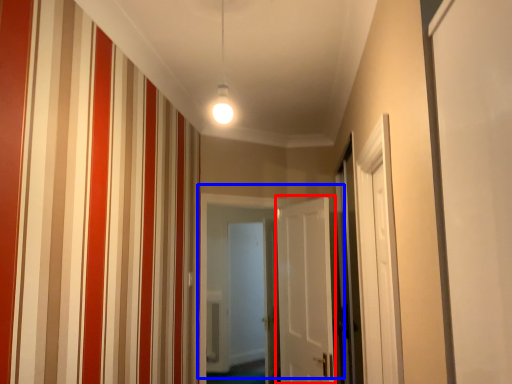
Question: Among these objects, which one is farthest to the camera, door (highlighted by a red box) or door (highlighted by a blue box)?

Choices:
 (A) door
 (B) door

Answer: (B)